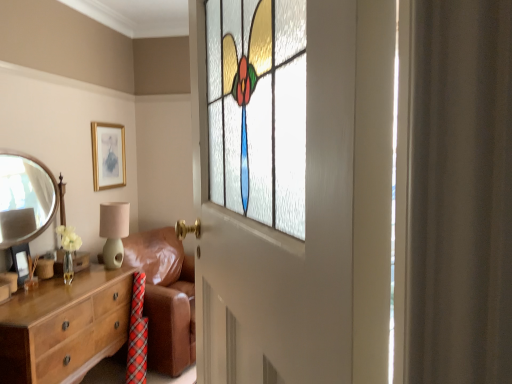
Question: From the image's perspective, is wooden chest of drawers at left above or below stained glass window at center?

Choices:
 (A) above
 (B) below

Answer: (B)

Question: Choose the correct answer: Is wooden chest of drawers at left inside stained glass window at center or outside it?

Choices:
 (A) inside
 (B) outside

Answer: (B)

Question: Which is nearer to the gold metallic picture frame at upper center, marked as the first picture frame in a top-to-bottom arrangement?

Choices:
 (A) matte gold picture frame at lower left, positioned as the second picture frame in right-to-left order
 (B) silver metallic mirror at left
 (C) matte green ceramic table lamp at left
 (D) stained glass window at center
 (E) wooden chest of drawers at left

Answer: (C)

Question: Estimate the real-world distances between objects in this image. Which object is closer to the silver metallic mirror at left?

Choices:
 (A) gold metallic picture frame at upper center, the second picture frame from the front
 (B) brown leather couch at center
 (C) matte gold picture frame at lower left, positioned as the second picture frame in right-to-left order
 (D) stained glass window at center
 (E) wooden chest of drawers at left

Answer: (A)